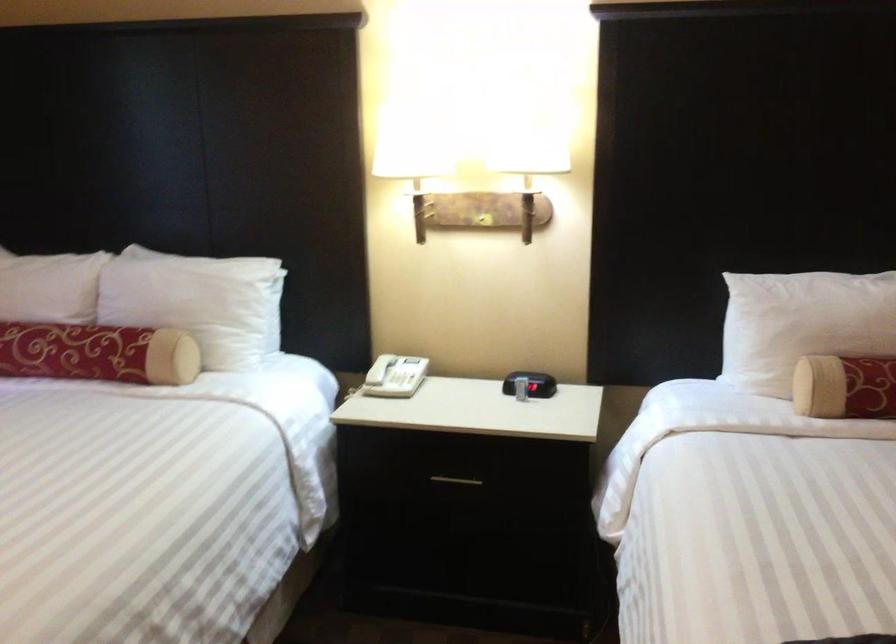
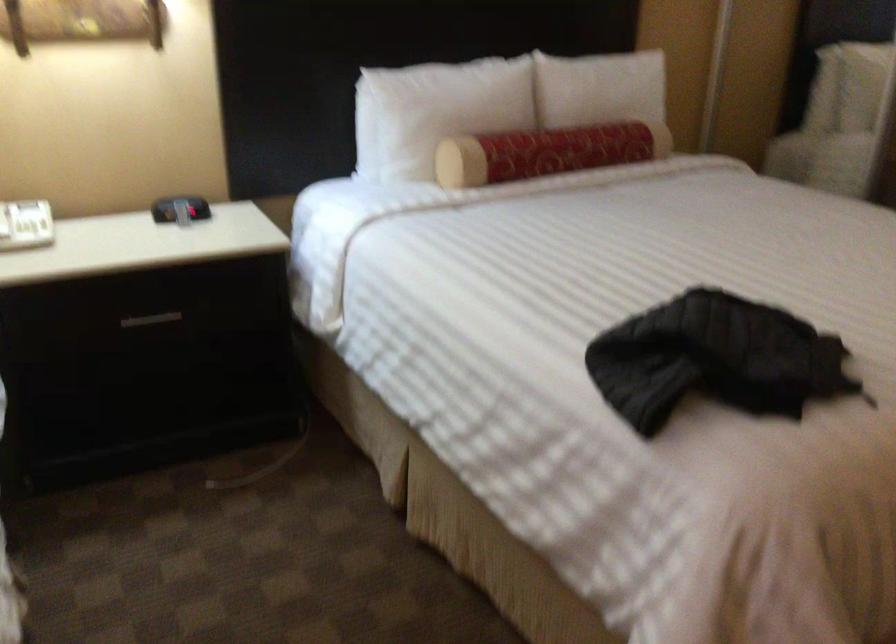
The point at (797,319) is marked in the first image. Where is the corresponding point in the second image?

(435, 111)